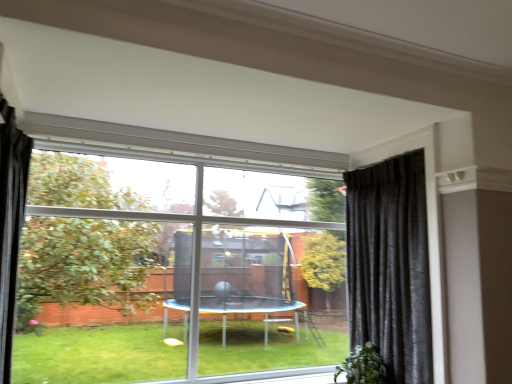
Question: Would you consider transparent glass window at center to be distant from green leafy plant at lower right?

Choices:
 (A) yes
 (B) no

Answer: (A)

Question: Is transparent glass window at center at the left side of green leafy plant at lower right?

Choices:
 (A) no
 (B) yes

Answer: (B)

Question: Could you tell me if transparent glass window at center is facing green leafy plant at lower right?

Choices:
 (A) yes
 (B) no

Answer: (A)

Question: Is transparent glass window at center oriented away from green leafy plant at lower right?

Choices:
 (A) yes
 (B) no

Answer: (B)

Question: Can you confirm if transparent glass window at center is smaller than green leafy plant at lower right?

Choices:
 (A) yes
 (B) no

Answer: (B)

Question: Is black velvet curtain at left, placed as the first curtain when sorted from front to back, inside or outside of black velvet curtain at right, positioned as the 1th curtain in right-to-left order?

Choices:
 (A) outside
 (B) inside

Answer: (A)

Question: Relative to black velvet curtain at right, which is counted as the second curtain, starting from the front, is black velvet curtain at left, placed as the first curtain when sorted from front to back, in front or behind?

Choices:
 (A) behind
 (B) front

Answer: (B)

Question: From a real-world perspective, relative to black velvet curtain at right, acting as the 2th curtain starting from the left, is black velvet curtain at left, placed as the 2th curtain when sorted from back to front, vertically above or below?

Choices:
 (A) below
 (B) above

Answer: (B)

Question: From the image's perspective, relative to black velvet curtain at right, acting as the 2th curtain starting from the left, is black velvet curtain at left, placed as the first curtain when sorted from front to back, above or below?

Choices:
 (A) above
 (B) below

Answer: (A)

Question: Looking at the image, does transparent glass window at center seem bigger or smaller compared to black velvet curtain at right, acting as the 2th curtain starting from the left?

Choices:
 (A) small
 (B) big

Answer: (B)

Question: Choose the correct answer: Is transparent glass window at center inside black velvet curtain at right, positioned as the 1th curtain in right-to-left order, or outside it?

Choices:
 (A) inside
 (B) outside

Answer: (B)

Question: From a real-world perspective, relative to black velvet curtain at right, positioned as the 1th curtain in right-to-left order, is transparent glass window at center vertically above or below?

Choices:
 (A) below
 (B) above

Answer: (B)

Question: From the image's perspective, is transparent glass window at center above or below black velvet curtain at right, acting as the 2th curtain starting from the left?

Choices:
 (A) above
 (B) below

Answer: (A)

Question: From the image's perspective, is transparent glass window at center located above or below black velvet curtain at left, placed as the first curtain when sorted from front to back?

Choices:
 (A) below
 (B) above

Answer: (A)

Question: Looking at the image, does transparent glass window at center seem bigger or smaller compared to black velvet curtain at left, placed as the first curtain when sorted from front to back?

Choices:
 (A) big
 (B) small

Answer: (A)